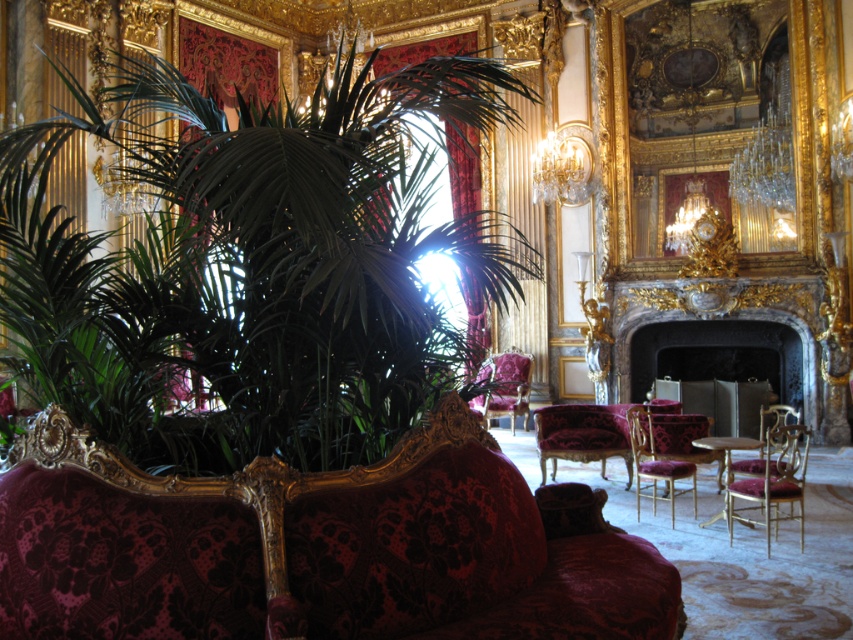
Question: Is green leafy plant at left to the left of velvet purple armchair at center from the viewer's perspective?

Choices:
 (A) yes
 (B) no

Answer: (A)

Question: Does velvet purple armchair at center come in front of velvet upholstered armchair at right?

Choices:
 (A) yes
 (B) no

Answer: (B)

Question: Among these objects, which one is farthest from the camera?

Choices:
 (A) velvet upholstered armchair at right
 (B) green leafy plant at left

Answer: (A)

Question: Based on their relative distances, which object is farther from the velvet burgundy armchair at right?

Choices:
 (A) velvet gold armchair at center
 (B) velvet upholstered armchair at right
 (C) velvet purple armchair at center
 (D) velvet couch at center

Answer: (C)

Question: Which object is closer to the camera taking this photo?

Choices:
 (A) velvet couch at center
 (B) velvet purple armchair at center
 (C) velvet upholstered armchair at right

Answer: (A)

Question: In this image, where is dark gray stone fireplace at center located relative to velvet burgundy armchair at right?

Choices:
 (A) below
 (B) above

Answer: (B)